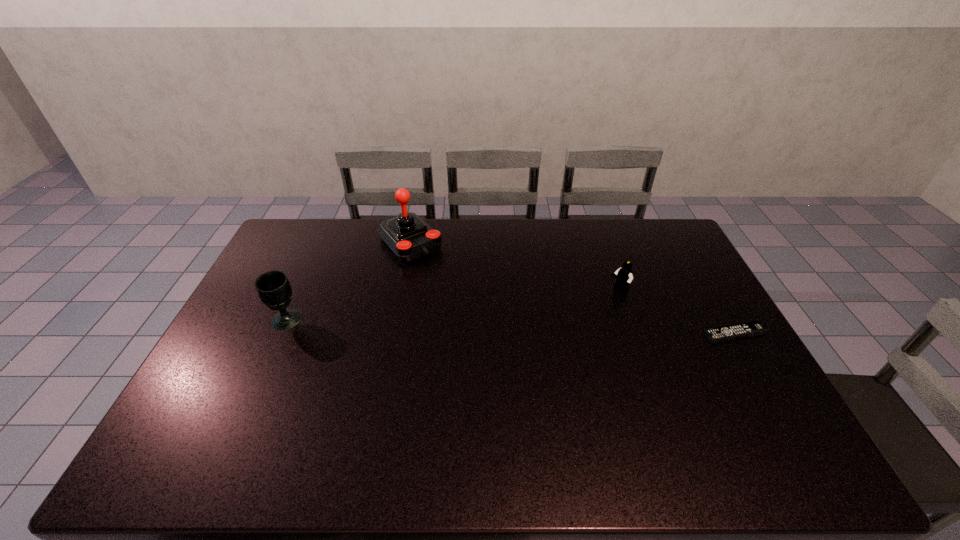
This screenshot has height=540, width=960. I want to click on free spot at the near edge of the desktop, so click(x=441, y=416).

Image resolution: width=960 pixels, height=540 pixels. I want to click on free space at the left edge, so click(243, 389).

I want to click on free space at the right edge of the desktop, so click(738, 343).

The height and width of the screenshot is (540, 960). Identify the location of free space between the third object from left to right and the farthest object. (515, 266).

The height and width of the screenshot is (540, 960). I want to click on free point between the third nearest object and the leftmost object, so click(453, 305).

You are a GUI agent. You are given a task and a screenshot of the screen. Output one action in this format:
    pyautogui.click(x=<x>, y=<y>)
    Task: Click on the free space between the second object from right to left and the shortest object
    The height and width of the screenshot is (540, 960).
    Given the screenshot: What is the action you would take?
    pyautogui.click(x=677, y=312)

Identify the location of empty location between the farthest object and the second shortest object. The image size is (960, 540). (515, 266).

You are a GUI agent. You are given a task and a screenshot of the screen. Output one action in this format:
    pyautogui.click(x=<x>, y=<y>)
    Task: Click on the free space between the chalice and the third object from left to right
    The image size is (960, 540).
    Given the screenshot: What is the action you would take?
    pyautogui.click(x=453, y=305)

The width and height of the screenshot is (960, 540). Find the location of `free space between the joystick and the second tallest object`. free space between the joystick and the second tallest object is located at coordinates (348, 281).

The height and width of the screenshot is (540, 960). In order to click on free space that is in between the third nearest object and the rightmost object in this screenshot , I will do `click(677, 312)`.